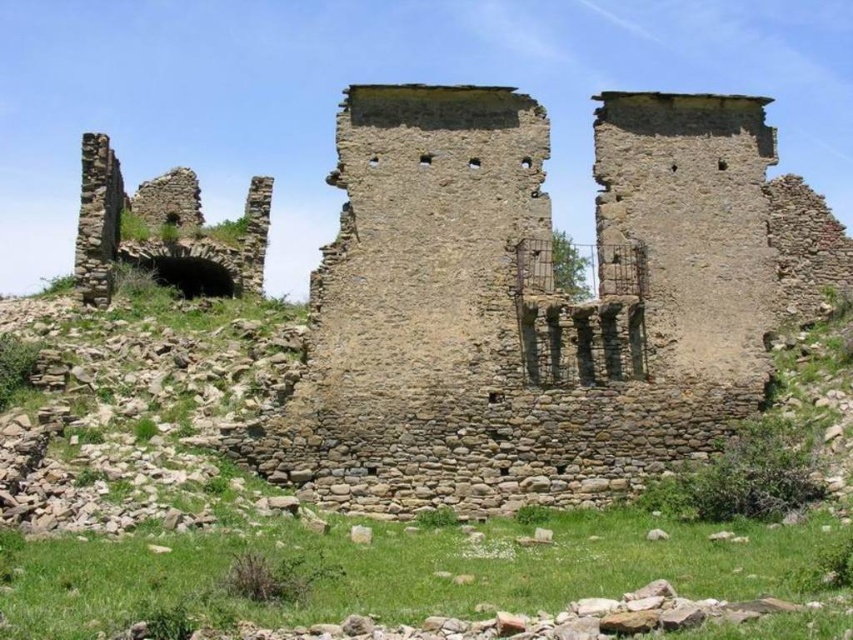
You are an archaeologist examining the ancient stone ruins. You notice the rustic stone castle at center and the rustic stone arch at left. Which structure is positioned lower in the scene?

The rustic stone castle at center is located below the rustic stone arch at left, so it is positioned lower in the scene.

You are an archaeologist examining the ancient ruins. You notice the rustic stone castle at center and the rustic stone arch at left. Which of these two structures is positioned more to the east? Please provide your answer based on the scene description.

The rustic stone arch at left is positioned more to the left side of the scene, so it is likely located to the east of the rustic stone castle at center.